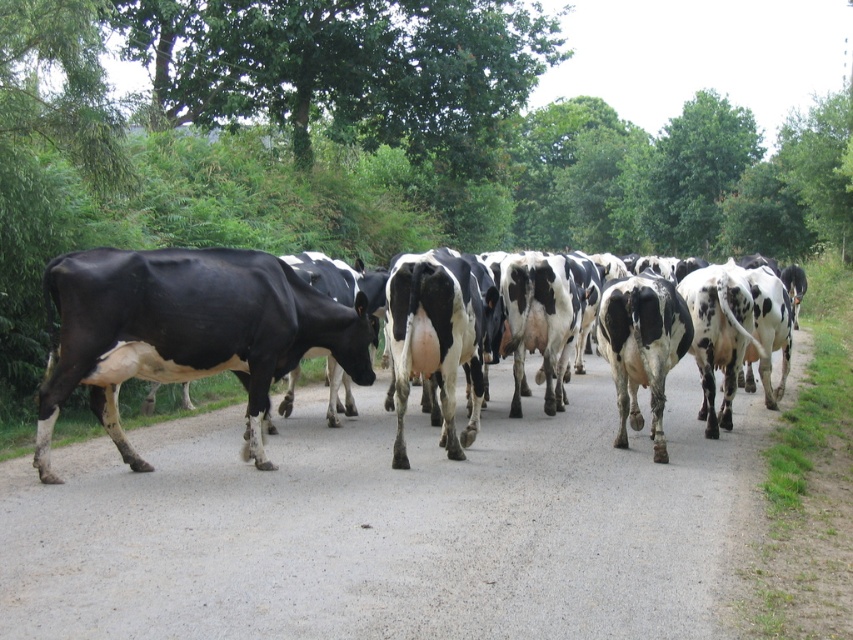
You are standing on the road and see the black glossy cow at left and the black glossy cow at center. Which cow is closer to the left side of the road?

The black glossy cow at left is closer to the left side of the road because it is positioned to the left of the black glossy cow at center.

You are a farmer observing the cows on the road. You need to determine which cow is wider between the black glossy cow at left and the black glossy cow at center. Which one is wider?

The black glossy cow at center is wider than the black glossy cow at left.

From the picture: You are standing on the road observing the cows. Which cow is positioned higher up in the image, the black glossy cow at left or the black glossy cow at center?

The black glossy cow at left is positioned higher up in the image than the black glossy cow at center.